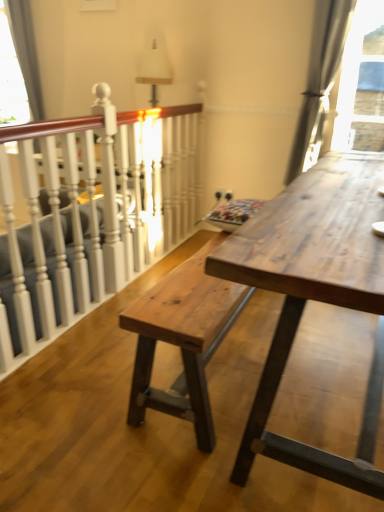
This screenshot has width=384, height=512. I want to click on empty space that is ontop of natural wood table at center (from a real-world perspective), so click(x=323, y=207).